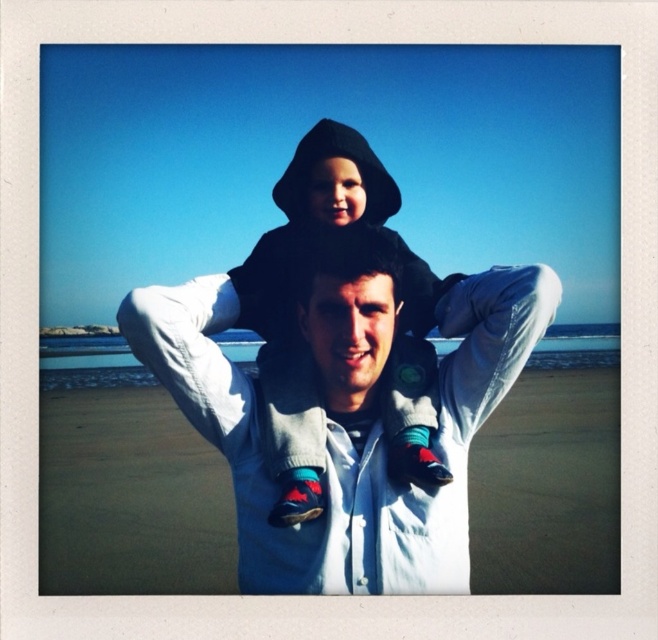
Question: Which point appears closest to the camera in this image?

Choices:
 (A) (280, 280)
 (B) (338, 259)

Answer: (B)

Question: Which of these objects is positioned farthest from the smooth white hoodie at center?

Choices:
 (A) black hoodie at center
 (B) white matte jacket at center

Answer: (A)

Question: Which object is positioned farthest from the smooth white hoodie at center?

Choices:
 (A) black hoodie at center
 (B) white matte jacket at center

Answer: (A)

Question: Does white matte jacket at center appear on the left side of black hoodie at center?

Choices:
 (A) yes
 (B) no

Answer: (A)

Question: Can you confirm if white matte jacket at center is positioned to the right of black hoodie at center?

Choices:
 (A) yes
 (B) no

Answer: (B)

Question: Can you confirm if black hoodie at center is thinner than smooth white hoodie at center?

Choices:
 (A) no
 (B) yes

Answer: (B)